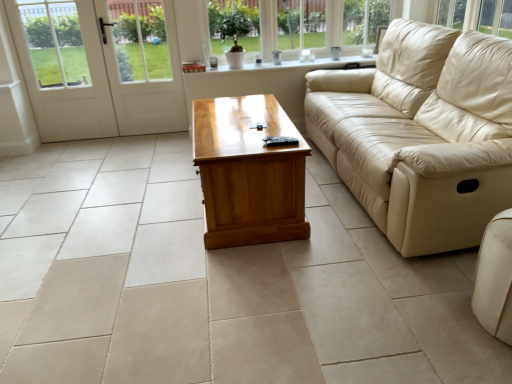
I want to click on space that is in front of white wooden screen door at left, so click(145, 148).